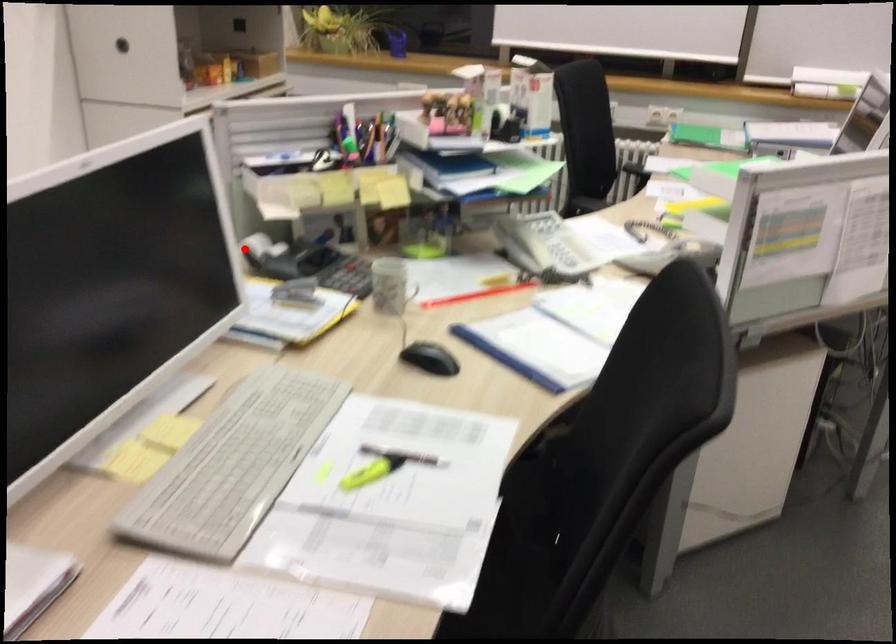
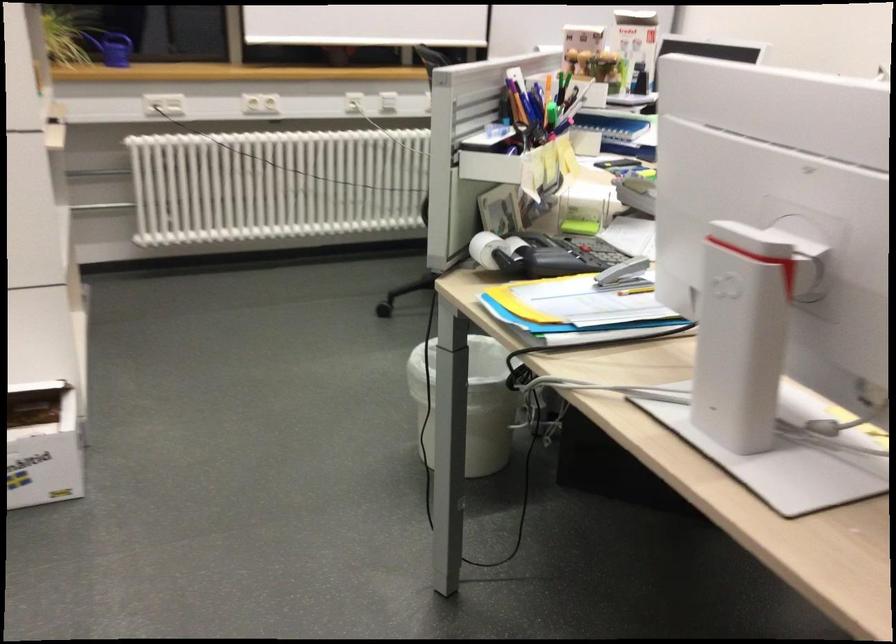
Question: I am providing you with two images of the same scene from different viewpoints. Given a red point in image1, look at the same physical point in image2. Is it:

Choices:
 (A) Closer to the viewpoint
 (B) Farther from the viewpoint

Answer: (A)